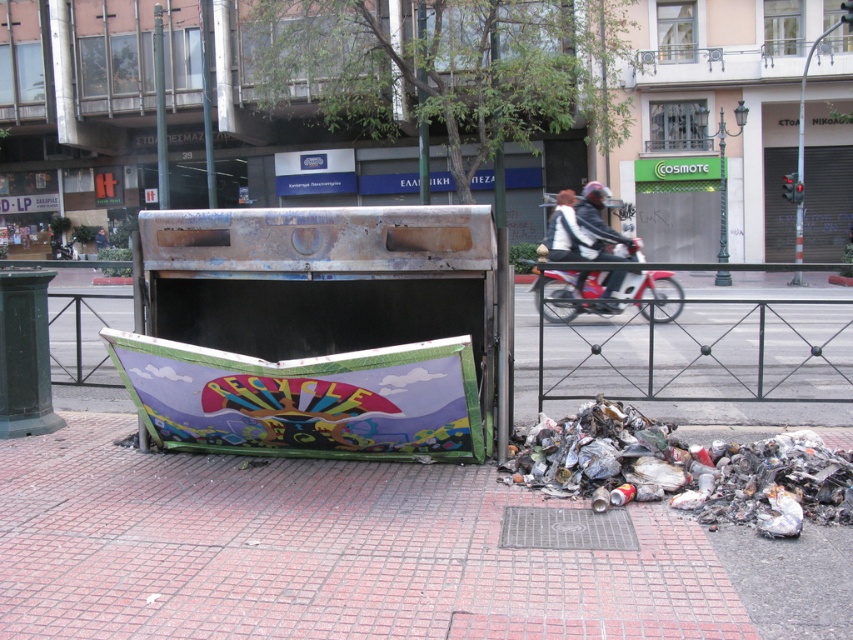
Question: Is brick pavement at lower left closer to camera compared to shiny metallic cans at lower right?

Choices:
 (A) no
 (B) yes

Answer: (B)

Question: Can you confirm if brick pavement at lower left is positioned above metallic red motorcycle at center?

Choices:
 (A) no
 (B) yes

Answer: (A)

Question: Which point is farther from the camera taking this photo?

Choices:
 (A) (675, 314)
 (B) (599, 204)

Answer: (A)

Question: Which is nearer to the brick pavement at lower left?

Choices:
 (A) metallic red motorcycle at center
 (B) shiny metallic cans at lower right
 (C) white leather jacket at center

Answer: (B)

Question: From the image, what is the correct spatial relationship of metallic red motorcycle at center in relation to white leather jacket at center?

Choices:
 (A) above
 (B) below

Answer: (B)

Question: Which point appears closest to the camera in this image?

Choices:
 (A) (824, 484)
 (B) (619, 298)
 (C) (631, 252)

Answer: (A)